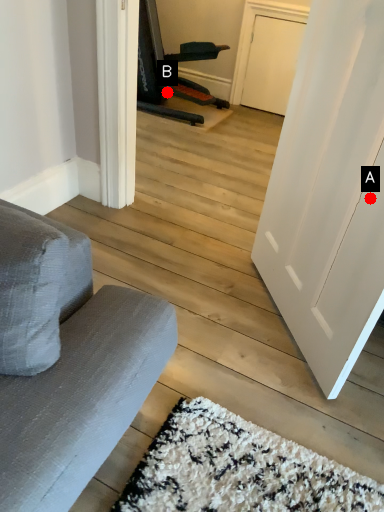
Question: Two points are circled on the image, labeled by A and B beside each circle. Which of the following is the farthest from the observer?

Choices:
 (A) A is further
 (B) B is further

Answer: (B)